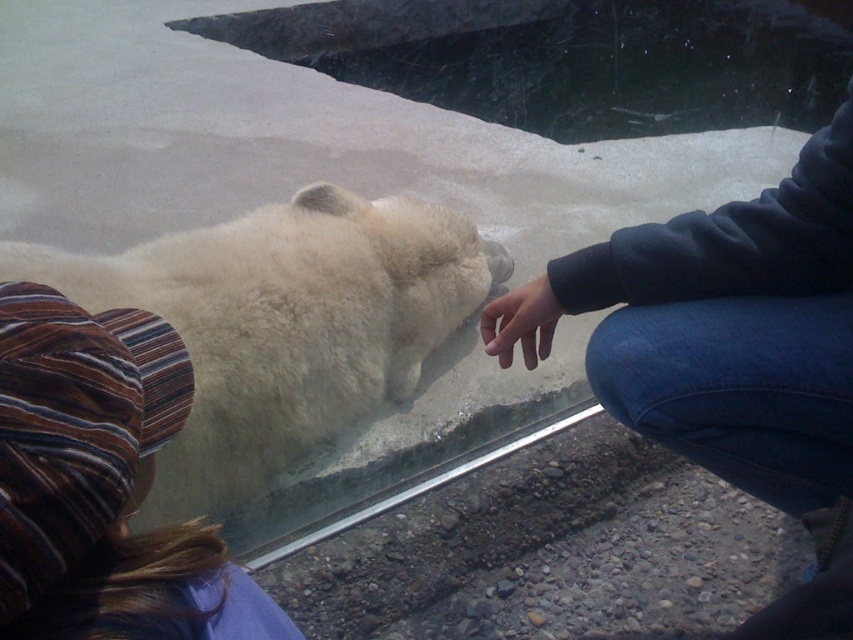
Does dark blue sweatshirt at upper right appear over matte black hand at center?

No, dark blue sweatshirt at upper right is not above matte black hand at center.

The height and width of the screenshot is (640, 853). What do you see at coordinates (743, 355) in the screenshot? I see `dark blue sweatshirt at upper right` at bounding box center [743, 355].

The image size is (853, 640). What do you see at coordinates (743, 355) in the screenshot?
I see `dark blue sweatshirt at upper right` at bounding box center [743, 355].

The image size is (853, 640). Identify the location of dark blue sweatshirt at upper right. [743, 355].

Which is below, dark blue sweatshirt at upper right or white fluffy polar bear at center?

Positioned lower is dark blue sweatshirt at upper right.

Is dark blue sweatshirt at upper right bigger than white fluffy polar bear at center?

Incorrect, dark blue sweatshirt at upper right is not larger than white fluffy polar bear at center.

Image resolution: width=853 pixels, height=640 pixels. What do you see at coordinates (743, 355) in the screenshot? I see `dark blue sweatshirt at upper right` at bounding box center [743, 355].

The width and height of the screenshot is (853, 640). What are the coordinates of `dark blue sweatshirt at upper right` in the screenshot? It's located at (743, 355).

Is striped fabric hat at upper left to the right of matte black hand at center from the viewer's perspective?

Incorrect, striped fabric hat at upper left is not on the right side of matte black hand at center.

Is striped fabric hat at upper left positioned behind matte black hand at center?

No, it is not.

Between point (229, 573) and point (494, 330), which one is positioned in front?

Positioned in front is point (229, 573).

This screenshot has height=640, width=853. Identify the location of striped fabric hat at upper left. 102,484.